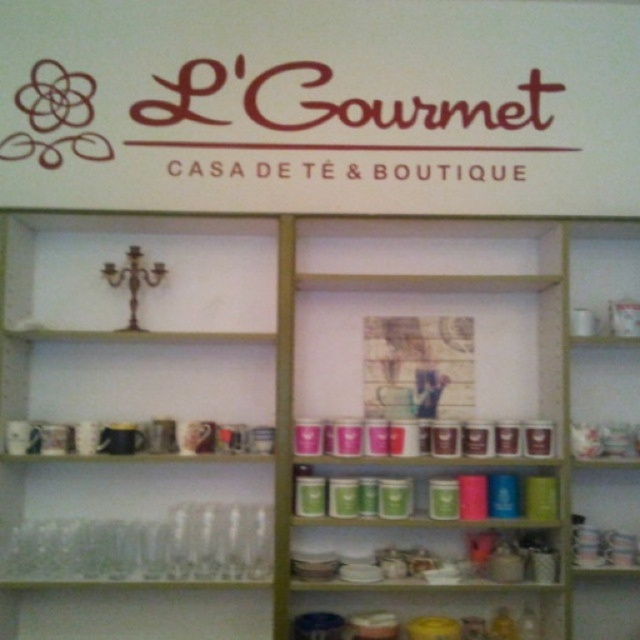
You are a customer standing in front of the shelving unit at L Gourmet Casa de T and you want to grab both the matte ceramic jars at lower center and the matte glass jars at center. Which one should you reach for first to get the one that is nearer to you?

The matte ceramic jars at lower center is closer to the viewer than the matte glass jars at center, so you should reach for the matte ceramic jars at lower center first.

You are a customer at L Gourmet Casa de T and you see two items at the center of the shelves matte ceramic bowls at center and matte glass jars at center. Which one is positioned to the left?

The matte ceramic bowls at center is positioned to the left of the matte glass jars at center.

What object is located at the coordinates point (438,604) in the image?

The point (438,604) corresponds to matte ceramic jars at lower center.